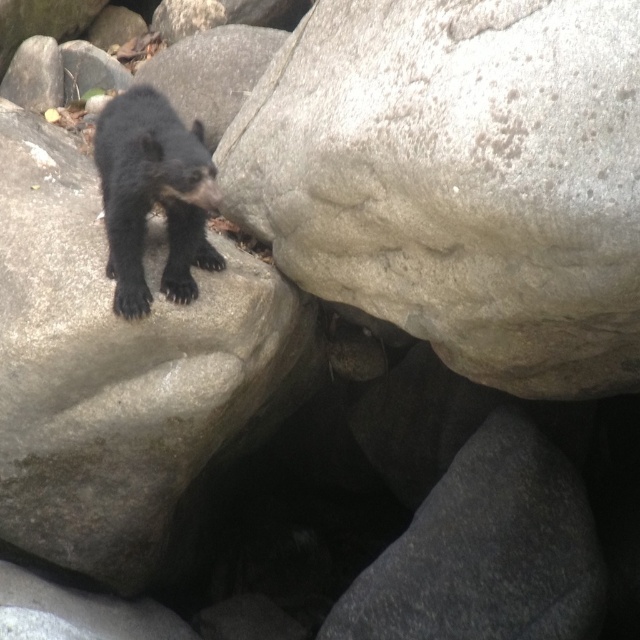
Question: Does gray rough boulder at center appear on the right side of matte gray rock at center?

Choices:
 (A) no
 (B) yes

Answer: (B)

Question: Estimate the real-world distances between objects in this image. Which object is closer to the matte gray rock at center?

Choices:
 (A) shiny black bear at upper left
 (B) gray rough boulder at center

Answer: (A)

Question: Which point appears closest to the camera in this image?

Choices:
 (A) tap(212, 326)
 (B) tap(108, 161)
 (C) tap(557, 376)

Answer: (B)

Question: Does gray rough boulder at center appear under shiny black bear at upper left?

Choices:
 (A) yes
 (B) no

Answer: (A)

Question: Which of the following is the closest to the observer?

Choices:
 (A) (416, 257)
 (B) (193, 220)

Answer: (A)

Question: Is the position of gray rough boulder at center less distant than that of shiny black bear at upper left?

Choices:
 (A) no
 (B) yes

Answer: (B)